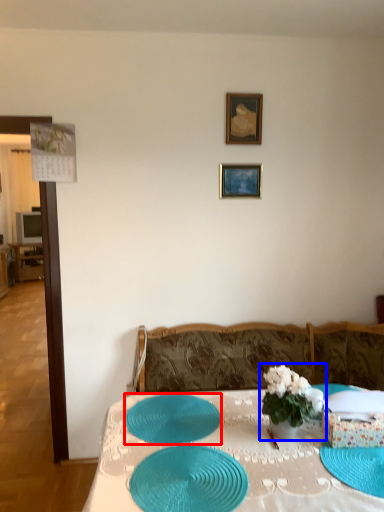
Question: Which of the following is the farthest to the observer, tableware (highlighted by a red box) or houseplant (highlighted by a blue box)?

Choices:
 (A) tableware
 (B) houseplant

Answer: (A)